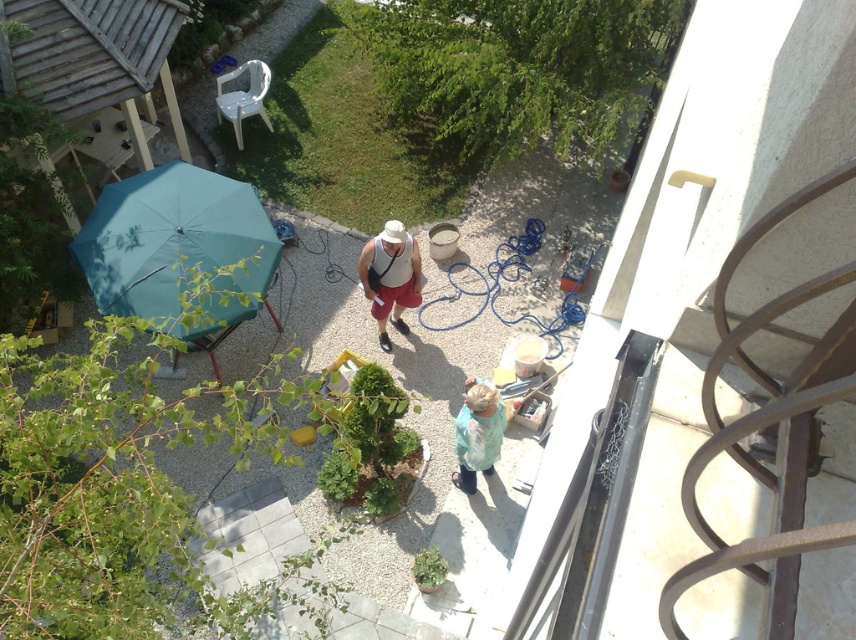
Is the position of teal fabric umbrella at left more distant than that of matte white tank top at center?

That is False.

Which is in front, point (147, 298) or point (396, 256)?

Point (147, 298) is in front.

I want to click on teal fabric umbrella at left, so click(x=176, y=244).

Between point (373, 259) and point (456, 444), which one is positioned behind?

The point (373, 259) is behind.

Which is more to the right, matte white tank top at center or light blue fabric at center?

From the viewer's perspective, light blue fabric at center appears more on the right side.

Is point (385, 296) more distant than point (506, 413)?

Yes, point (385, 296) is farther from viewer.

The image size is (856, 640). What are the coordinates of `matte white tank top at center` in the screenshot? It's located at (390, 276).

Between teal fabric umbrella at left and light blue fabric at center, which one appears on the left side from the viewer's perspective?

From the viewer's perspective, teal fabric umbrella at left appears more on the left side.

Between point (123, 314) and point (495, 452), which one is positioned in front?

Point (495, 452)

Identify the location of teal fabric umbrella at left. (176, 244).